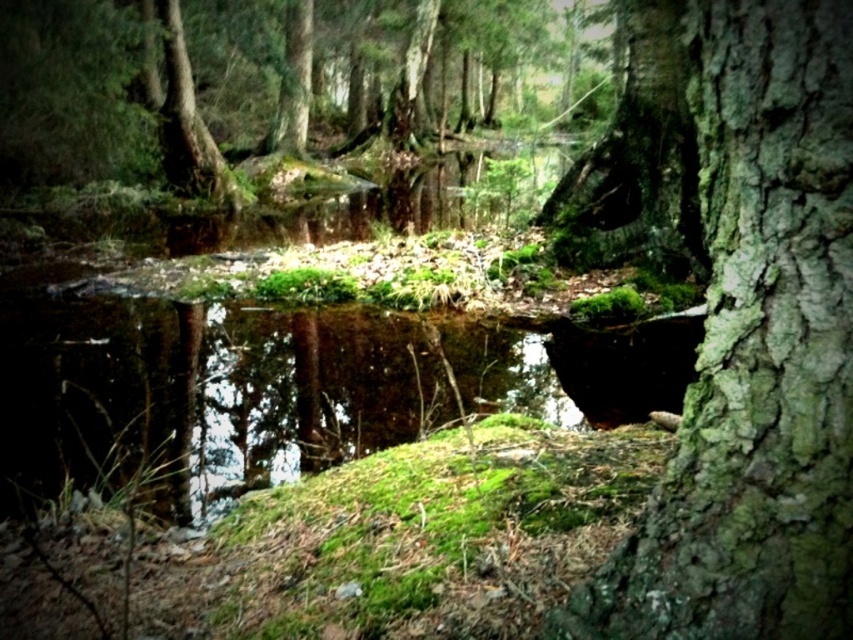
Question: In this image, where is green rough bark tree trunk at center located relative to green mossy bark tree trunk at upper left?

Choices:
 (A) above
 (B) below

Answer: (B)

Question: Can you confirm if green rough bark tree at center is positioned below green mossy bark tree trunk at upper left?

Choices:
 (A) no
 (B) yes

Answer: (B)

Question: Considering the real-world distances, which object is farthest from the green rough bark tree trunk at center?

Choices:
 (A) green mossy bark tree trunk at upper left
 (B) green rough bark tree at center

Answer: (A)

Question: Estimate the real-world distances between objects in this image. Which object is farther from the green rough bark tree trunk at center?

Choices:
 (A) green rough bark tree at center
 (B) green mossy bark tree trunk at upper left

Answer: (B)

Question: Which of the following is the closest to the observer?

Choices:
 (A) pyautogui.click(x=735, y=582)
 (B) pyautogui.click(x=207, y=192)
 (C) pyautogui.click(x=628, y=4)

Answer: (A)

Question: Does green rough bark tree at center lie behind green rough bark tree trunk at center?

Choices:
 (A) yes
 (B) no

Answer: (B)